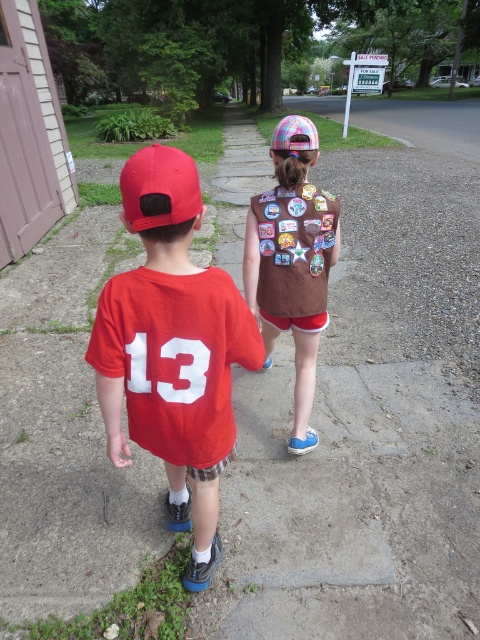
Question: Which of the following is the closest to the observer?

Choices:
 (A) (168, 172)
 (B) (300, 196)
 (C) (126, 442)

Answer: (A)

Question: Which point is farther from the camera taking this photo?

Choices:
 (A) (266, 189)
 (B) (123, 173)

Answer: (A)

Question: Estimate the real-world distances between objects in this image. Which object is closer to the brown matte vest at upper center?

Choices:
 (A) matte red cap at center
 (B) brown patchwork vest at center
 (C) smooth skin hand at lower left

Answer: (B)

Question: Is matte red cap at center closer to camera compared to smooth skin hand at lower left?

Choices:
 (A) yes
 (B) no

Answer: (A)

Question: Is the position of matte red baseball cap at left more distant than that of smooth skin hand at lower left?

Choices:
 (A) no
 (B) yes

Answer: (A)

Question: Does matte red cap at center come behind matte red baseball cap at left?

Choices:
 (A) no
 (B) yes

Answer: (A)